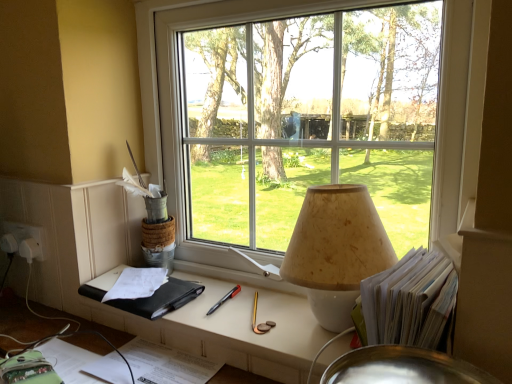
Question: Is beige textured lampshade at center shorter than white paper stack at right?

Choices:
 (A) no
 (B) yes

Answer: (A)

Question: Could you tell me if beige textured lampshade at center is facing white paper stack at right?

Choices:
 (A) no
 (B) yes

Answer: (A)

Question: Is beige textured lampshade at center wider than white paper stack at right?

Choices:
 (A) no
 (B) yes

Answer: (B)

Question: Can you confirm if beige textured lampshade at center is taller than white paper stack at right?

Choices:
 (A) yes
 (B) no

Answer: (A)

Question: Is beige textured lampshade at center not within white paper stack at right?

Choices:
 (A) yes
 (B) no

Answer: (A)

Question: Are beige textured lampshade at center and white paper stack at right located far from each other?

Choices:
 (A) yes
 (B) no

Answer: (B)

Question: From the image's perspective, is white paper stack at right under black leather notebook at lower left?

Choices:
 (A) no
 (B) yes

Answer: (A)

Question: From a real-world perspective, is white paper stack at right over black leather notebook at lower left?

Choices:
 (A) no
 (B) yes

Answer: (B)

Question: Does white paper stack at right have a greater height compared to black leather notebook at lower left?

Choices:
 (A) no
 (B) yes

Answer: (B)

Question: Is white paper stack at right located outside black leather notebook at lower left?

Choices:
 (A) yes
 (B) no

Answer: (A)

Question: Is the position of white paper stack at right less distant than that of black leather notebook at lower left?

Choices:
 (A) yes
 (B) no

Answer: (A)

Question: Considering the relative sizes of white paper stack at right and black leather notebook at lower left in the image provided, is white paper stack at right smaller than black leather notebook at lower left?

Choices:
 (A) yes
 (B) no

Answer: (A)

Question: From the image's perspective, is black leather notebook at lower left over transparent glass window at center?

Choices:
 (A) yes
 (B) no

Answer: (B)